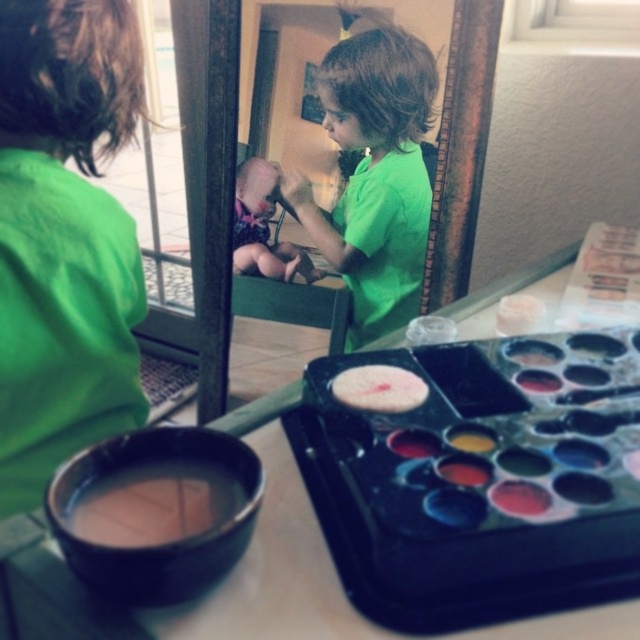
Image resolution: width=640 pixels, height=640 pixels. What do you see at coordinates (374, 176) in the screenshot?
I see `green matte shirt at center` at bounding box center [374, 176].

The image size is (640, 640). What do you see at coordinates (374, 176) in the screenshot?
I see `green matte shirt at center` at bounding box center [374, 176].

This screenshot has height=640, width=640. I want to click on green matte shirt at center, so click(x=374, y=176).

Does shiny plastic paint tray at lower right appear over brown matte paint at lower left?

Yes, shiny plastic paint tray at lower right is above brown matte paint at lower left.

Is point (634, 532) positioned before point (150, 524)?

Yes, it is.

Which is behind, point (618, 566) or point (145, 484)?

Point (145, 484)

What are the coordinates of `shiny plastic paint tray at lower right` in the screenshot? It's located at (480, 481).

Is green matte shirt at upper left thinner than green matte shirt at center?

Indeed, green matte shirt at upper left has a lesser width compared to green matte shirt at center.

Is point (93, 97) closer to viewer compared to point (376, 208)?

That is True.

Between point (106, 234) and point (426, 228), which one is positioned behind?

The point (426, 228) is more distant.

Find the location of a particular element. This screenshot has width=640, height=640. green matte shirt at upper left is located at coordinates (65, 237).